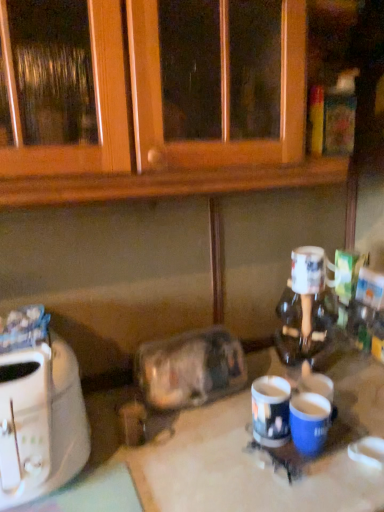
The height and width of the screenshot is (512, 384). What are the coordinates of `vacant area situated to the left side of blue matte mug at lower center, which is the 3th coffee cup from top to bottom` in the screenshot? It's located at (218, 453).